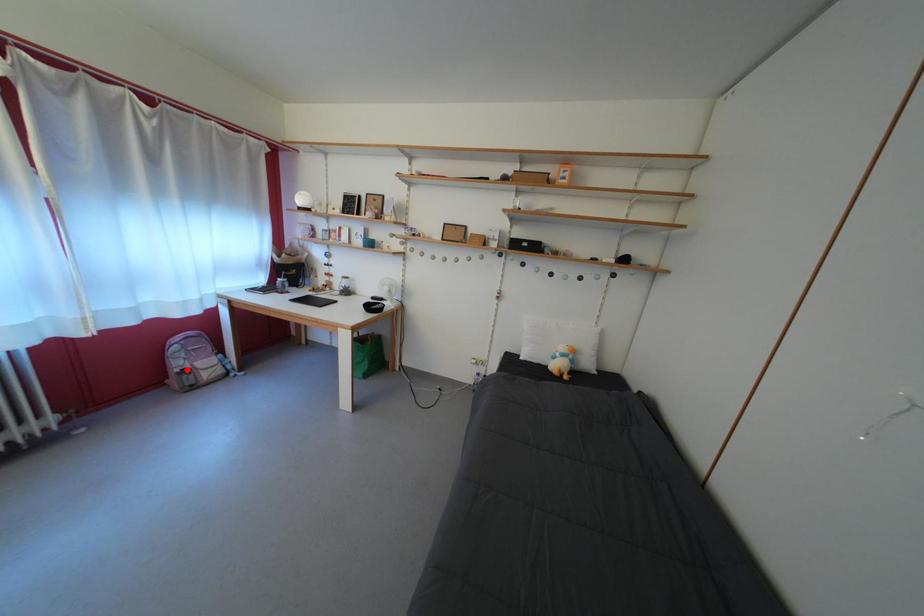
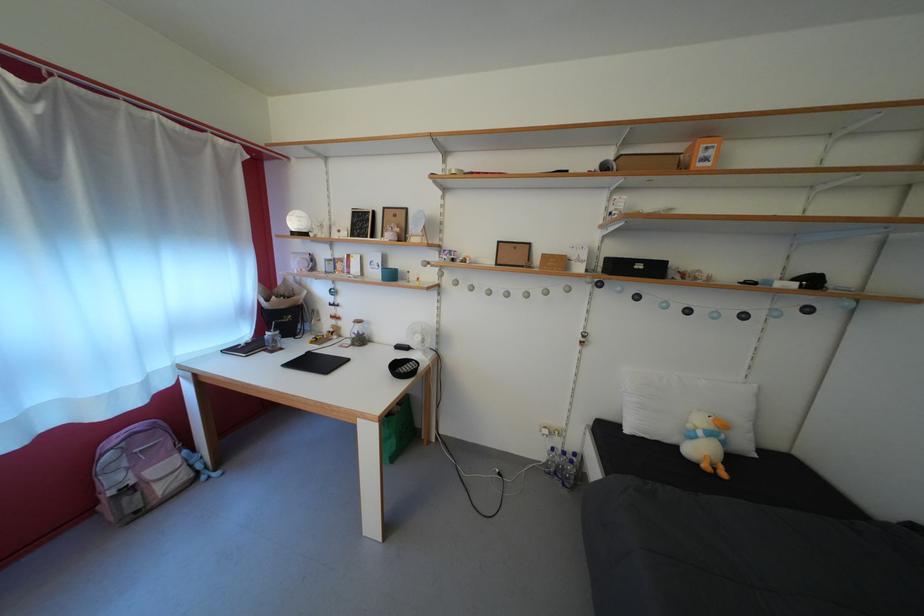
In the second image, find the point that corresponds to the highlighted location in the first image.

(123, 485)